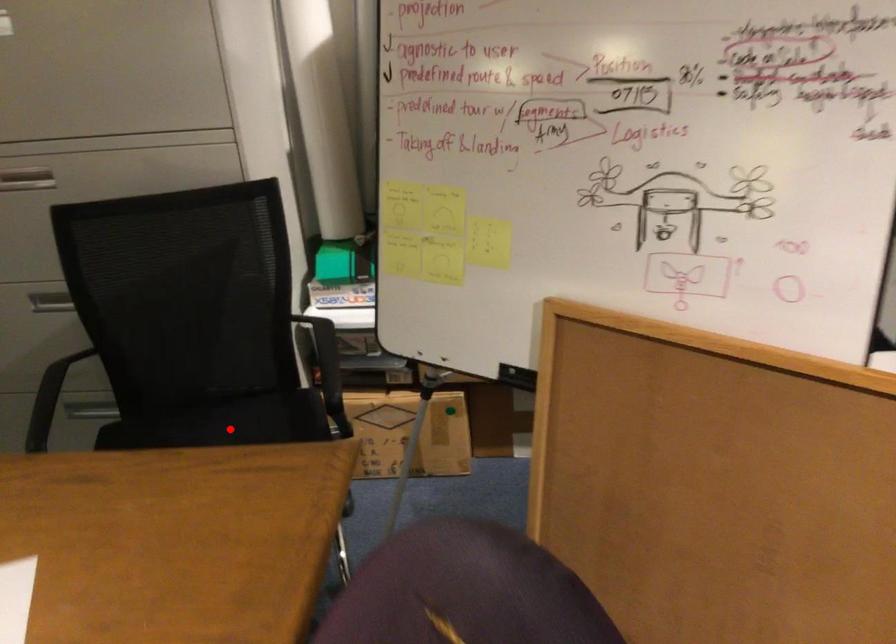
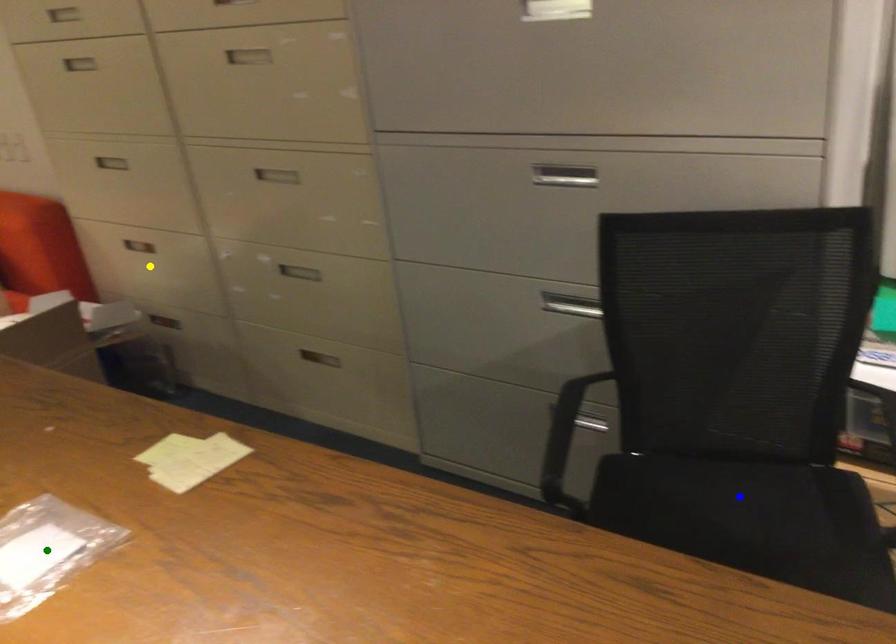
Question: I am providing you with two images of the same scene from different viewpoints. A red point is marked on the first image. You are given multiple points on the second image. Which point in image 2 represents the same 3d spot as the red point in image 1?

Choices:
 (A) green point
 (B) yellow point
 (C) blue point

Answer: (C)